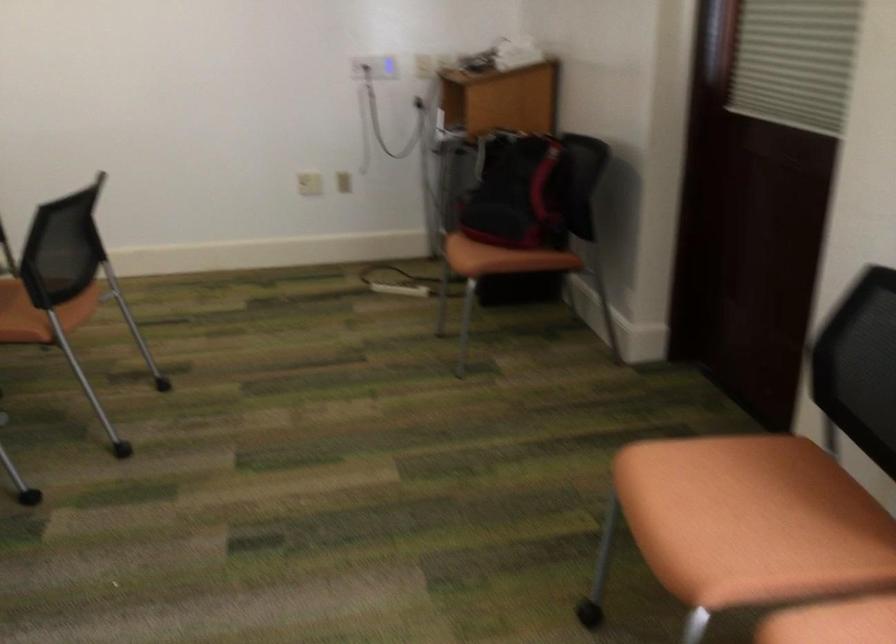
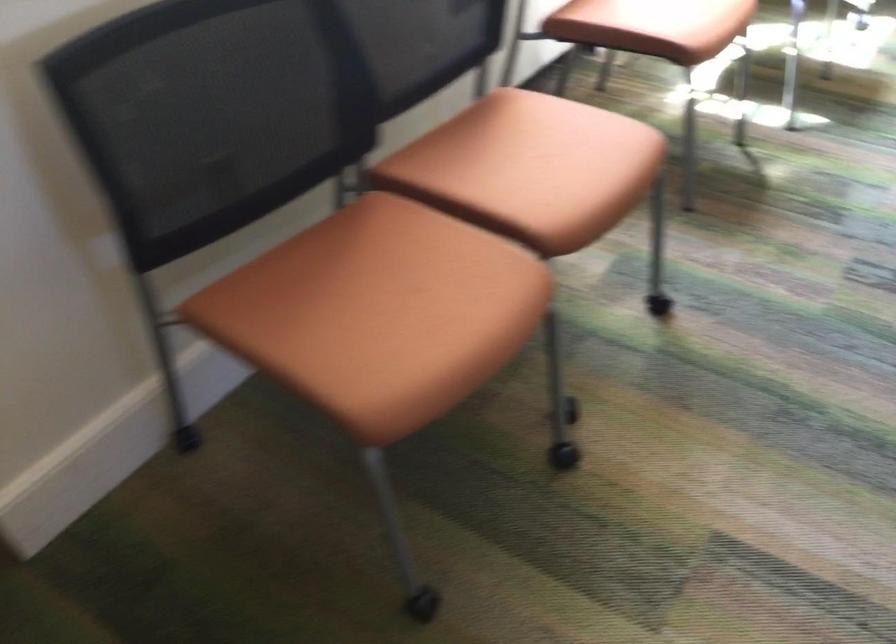
Find the pixel in the second image that matches [735,500] in the first image.

(359, 315)